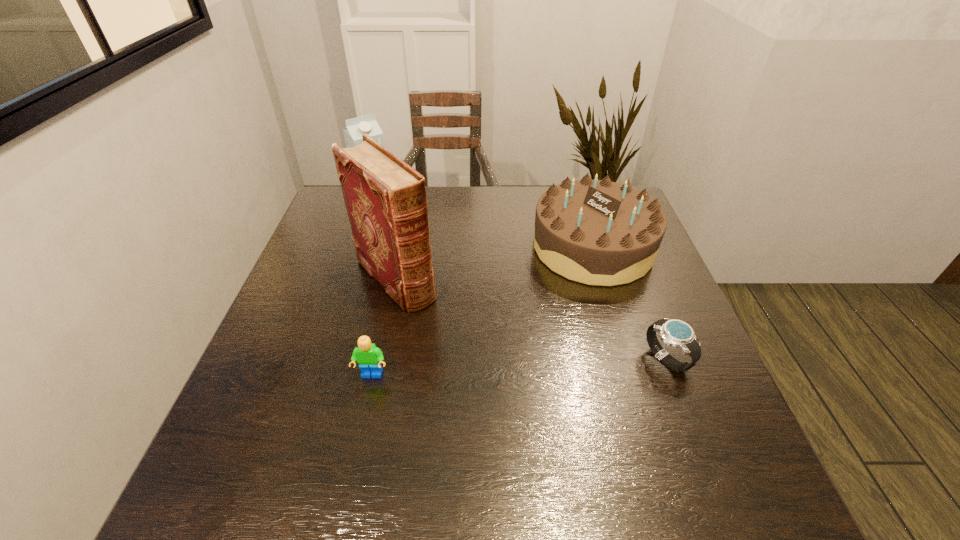
The width and height of the screenshot is (960, 540). I want to click on vacant area that satisfies the following two spatial constraints: 1. on the front side of the tallest object; 2. on the right side of the carton, so click(351, 279).